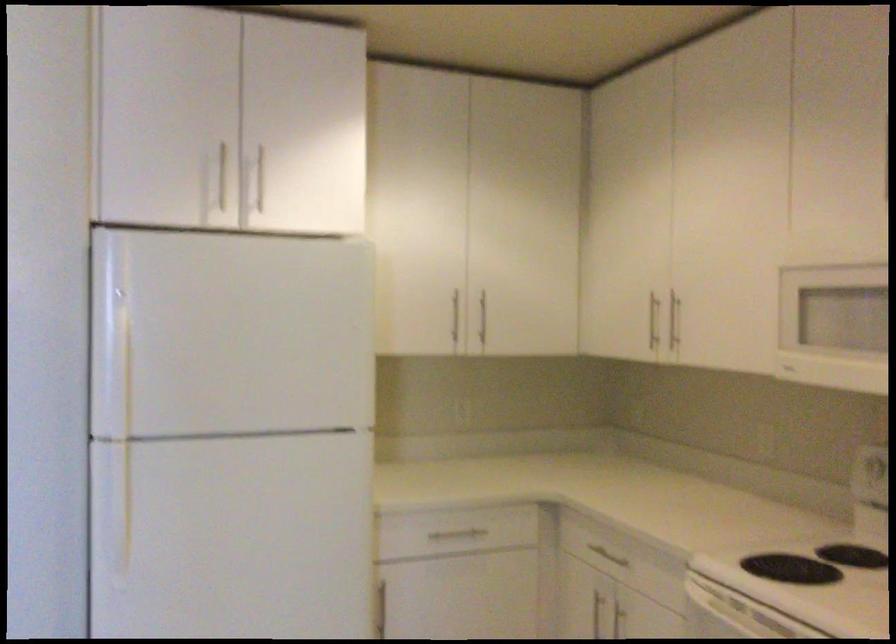
The image size is (896, 644). Identify the location of silver drawer handle. (455, 536).